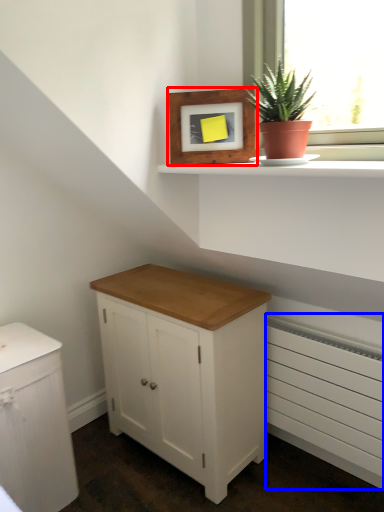
Question: Which object is closer to the camera taking this photo, picture frame (highlighted by a red box) or radiator (highlighted by a blue box)?

Choices:
 (A) picture frame
 (B) radiator

Answer: (A)